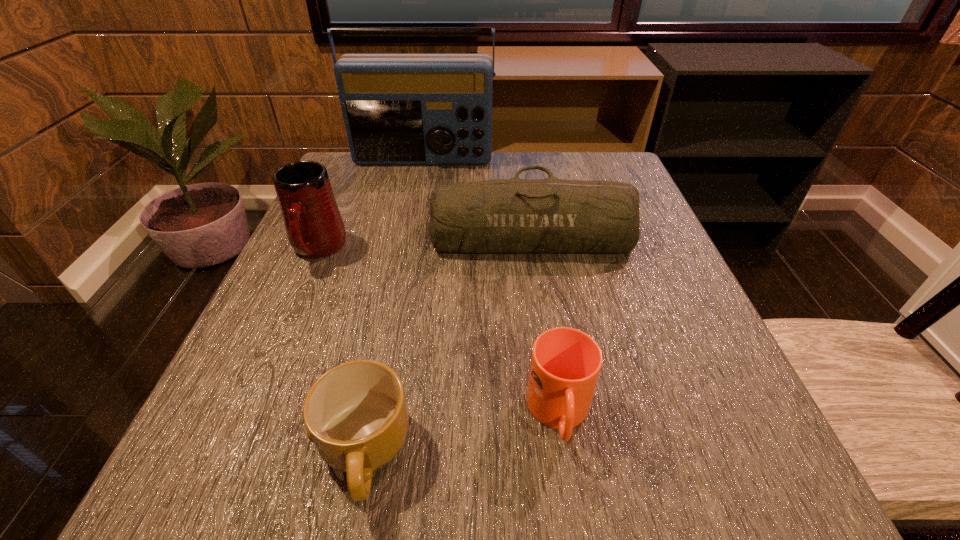
Find the location of a particular element. The height and width of the screenshot is (540, 960). radio receiver is located at coordinates (399, 109).

You are a GUI agent. You are given a task and a screenshot of the screen. Output one action in this format:
    pyautogui.click(x=<x>, y=<y>)
    Task: Click on the tallest object
    
    Given the screenshot: What is the action you would take?
    pyautogui.click(x=399, y=109)

At what (x,y) coordinates should I click in order to perform the action: click on the tallest mug. Please return your answer as a coordinate pair (x, y). The height and width of the screenshot is (540, 960). Looking at the image, I should click on (314, 226).

In order to click on the farthest mug in this screenshot , I will do `click(314, 226)`.

The width and height of the screenshot is (960, 540). I want to click on the third tallest object, so click(x=502, y=216).

Where is `the fourth tallest object`? The image size is (960, 540). the fourth tallest object is located at coordinates (565, 365).

At what (x,y) coordinates should I click in order to perform the action: click on the rightmost mug. Please return your answer as a coordinate pair (x, y). Image resolution: width=960 pixels, height=540 pixels. Looking at the image, I should click on (565, 365).

This screenshot has height=540, width=960. Identify the location of the shortest mug. (356, 414).

Find the location of a particular element. Image resolution: width=960 pixels, height=540 pixels. the second mug from left to right is located at coordinates (356, 414).

At what (x,y) coordinates should I click in order to perform the action: click on vacant space located on the front panel of the radio receiver. Please return your answer as a coordinate pair (x, y). Looking at the image, I should click on (399, 278).